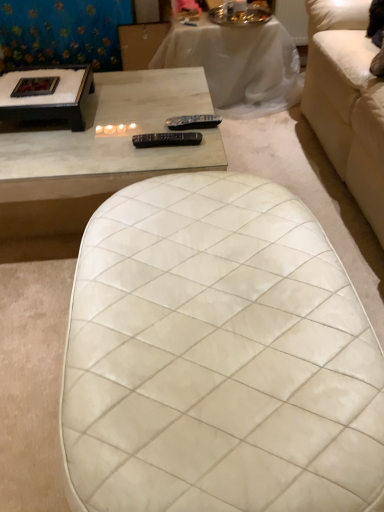
The width and height of the screenshot is (384, 512). I want to click on free space in front of black wood coffee table at upper left, which ranks as the second coffee table in right-to-left order, so click(x=52, y=155).